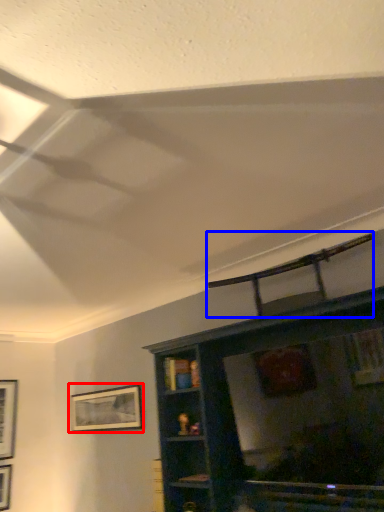
Question: Among these objects, which one is farthest to the camera, picture frame (highlighted by a red box) or swivel chair (highlighted by a blue box)?

Choices:
 (A) picture frame
 (B) swivel chair

Answer: (A)